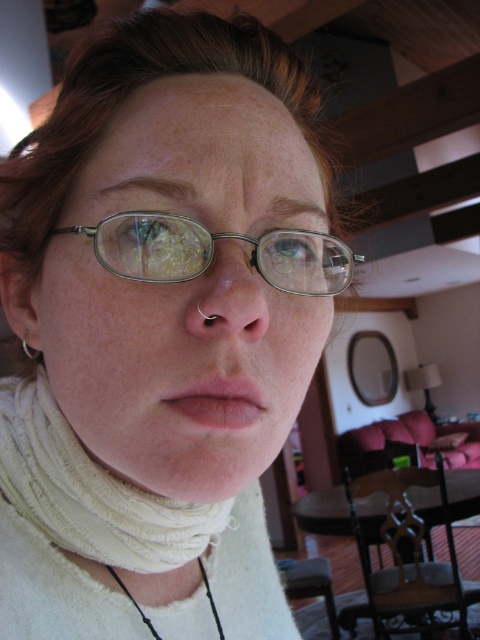
You are a makeup artist trying to apply lipstick. You look at the image and see the matte silver glasses at center and the pink matte lips at center. Which object is higher up on the face?

The matte silver glasses at center is much taller as pink matte lips at center, so the glasses are higher up on the face than the lips.

Based on the scene description, which object is positioned higher on the person wearing glasses? The white ribbed turtleneck at center or the pink matte lips at center?

The white ribbed turtleneck at center is taller than the pink matte lips at center, so it is positioned higher.